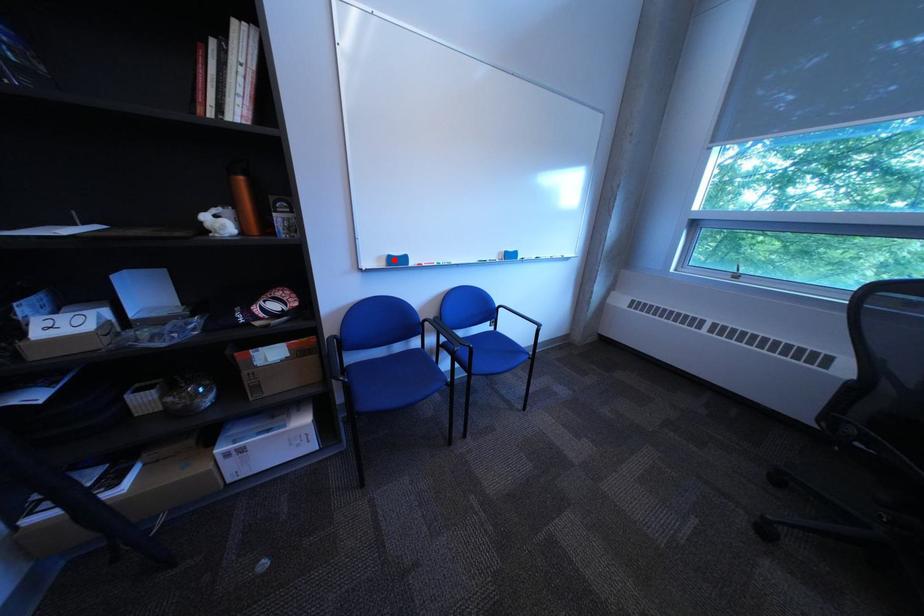
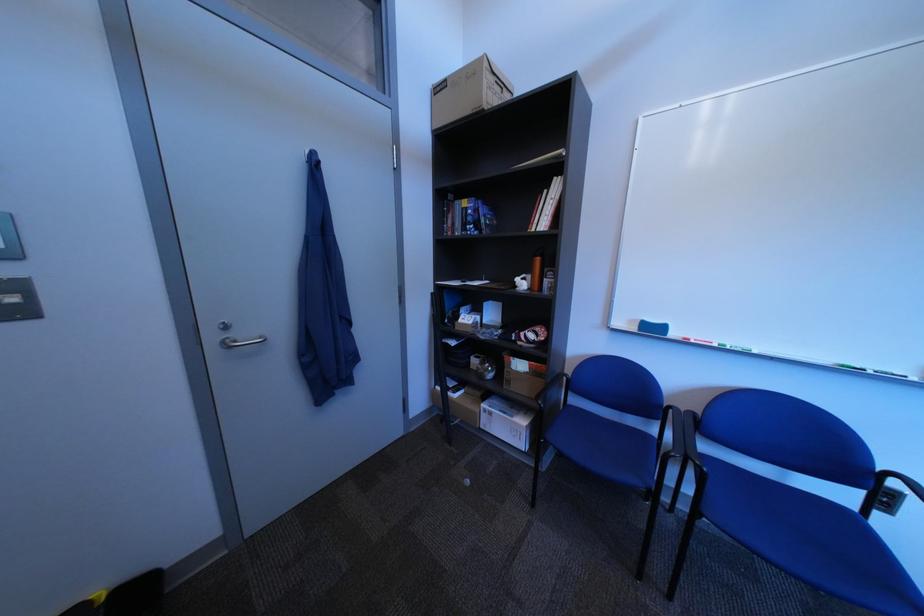
Locate, in the second image, the point that corresponds to the highlighted location in the first image.

(647, 323)